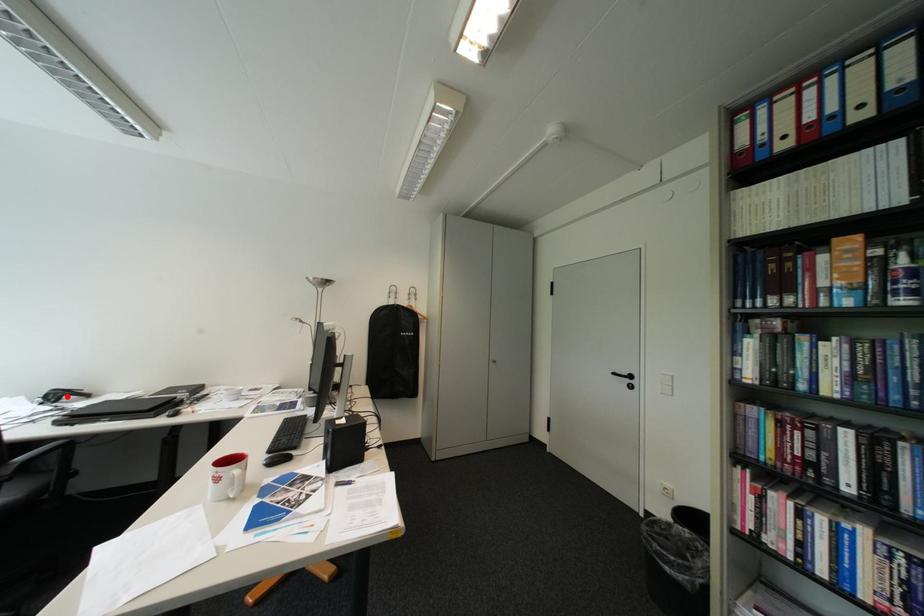
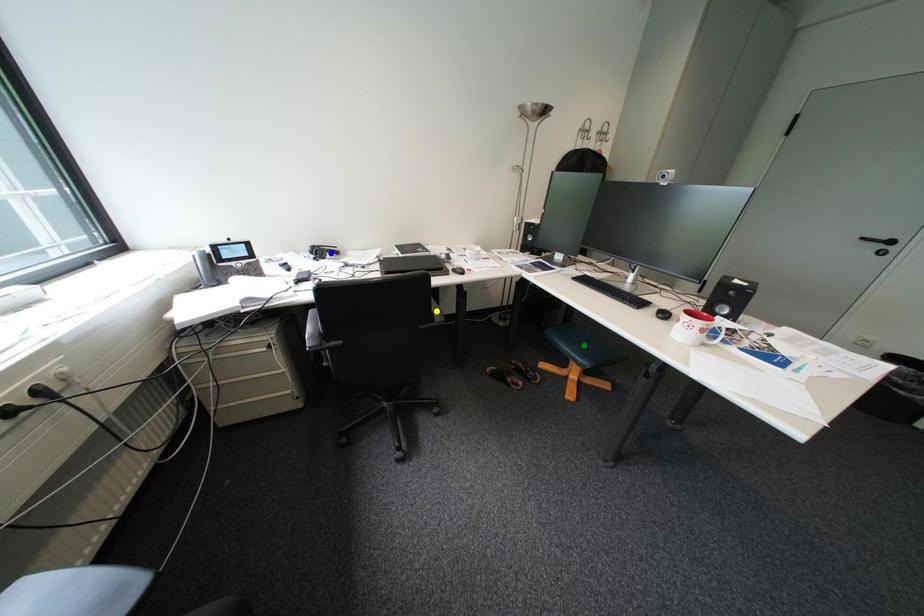
Question: I am providing you with two images of the same scene from different viewpoints. A red point is marked on the first image. You are given multiple points on the second image. Which mark in image 2 goes with the point in image 1?

Choices:
 (A) green point
 (B) yellow point
 (C) blue point

Answer: (C)